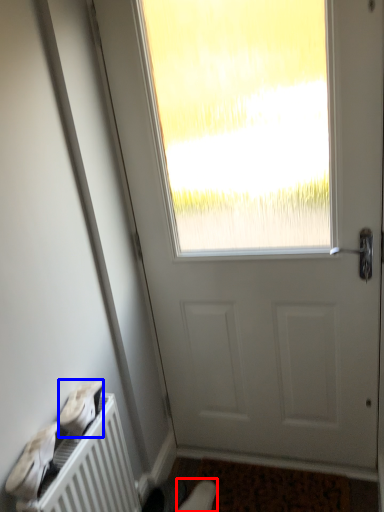
Question: Which of the following is the closest to the observer, shoe (highlighted by a red box) or shoe (highlighted by a blue box)?

Choices:
 (A) shoe
 (B) shoe

Answer: (B)